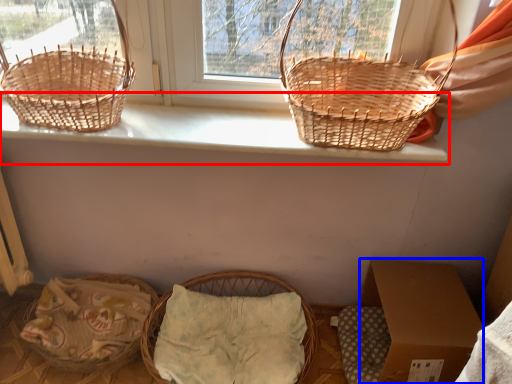
Question: Which object is further to the camera taking this photo, window sill (highlighted by a red box) or cardboard box (highlighted by a blue box)?

Choices:
 (A) window sill
 (B) cardboard box

Answer: (B)